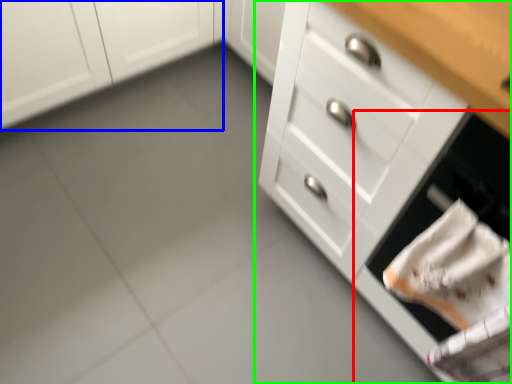
Question: Considering the real-world distances, which object is closest to oven (highlighted by a red box)? cabinetry (highlighted by a blue box) or chest of drawers (highlighted by a green box).

Choices:
 (A) cabinetry
 (B) chest of drawers

Answer: (B)